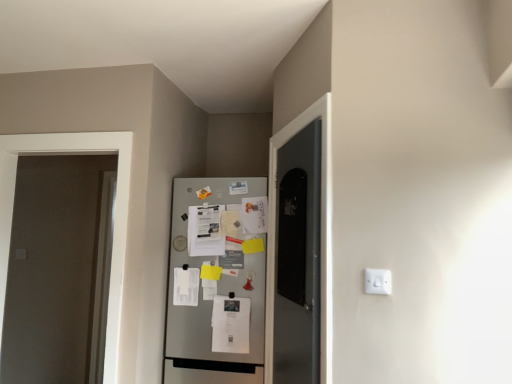
Question: Is white matte door at left bigger than white plastic electric outlet at center right?

Choices:
 (A) yes
 (B) no

Answer: (A)

Question: Is white matte door at left taller than white plastic electric outlet at center right?

Choices:
 (A) yes
 (B) no

Answer: (A)

Question: From a real-world perspective, is white matte door at left below white plastic electric outlet at center right?

Choices:
 (A) no
 (B) yes

Answer: (A)

Question: From the image's perspective, is white matte door at left on white plastic electric outlet at center right?

Choices:
 (A) yes
 (B) no

Answer: (B)

Question: From the image's perspective, is white matte door at left located beneath white plastic electric outlet at center right?

Choices:
 (A) no
 (B) yes

Answer: (B)

Question: Based on their positions, is metallic silver refrigerator at center located to the left or right of white matte door at left?

Choices:
 (A) right
 (B) left

Answer: (A)

Question: From the image's perspective, is metallic silver refrigerator at center above or below white matte door at left?

Choices:
 (A) below
 (B) above

Answer: (A)

Question: Considering the positions of metallic silver refrigerator at center and white matte door at left in the image, is metallic silver refrigerator at center bigger or smaller than white matte door at left?

Choices:
 (A) big
 (B) small

Answer: (A)

Question: From a real-world perspective, is metallic silver refrigerator at center physically located above or below white matte door at left?

Choices:
 (A) above
 (B) below

Answer: (B)

Question: Considering their positions, is white plastic electric outlet at center right located in front of or behind white matte door at left?

Choices:
 (A) front
 (B) behind

Answer: (A)

Question: Is white plastic electric outlet at center right bigger or smaller than white matte door at left?

Choices:
 (A) small
 (B) big

Answer: (A)

Question: From the image's perspective, relative to white matte door at left, is white plastic electric outlet at center right above or below?

Choices:
 (A) below
 (B) above

Answer: (B)

Question: From a real-world perspective, relative to white matte door at left, is white plastic electric outlet at center right vertically above or below?

Choices:
 (A) below
 (B) above

Answer: (A)

Question: Looking at their shapes, would you say white plastic electric outlet at center right is wider or thinner than metallic silver refrigerator at center?

Choices:
 (A) thin
 (B) wide

Answer: (A)

Question: From the image's perspective, is white plastic electric outlet at center right located above or below metallic silver refrigerator at center?

Choices:
 (A) above
 (B) below

Answer: (A)